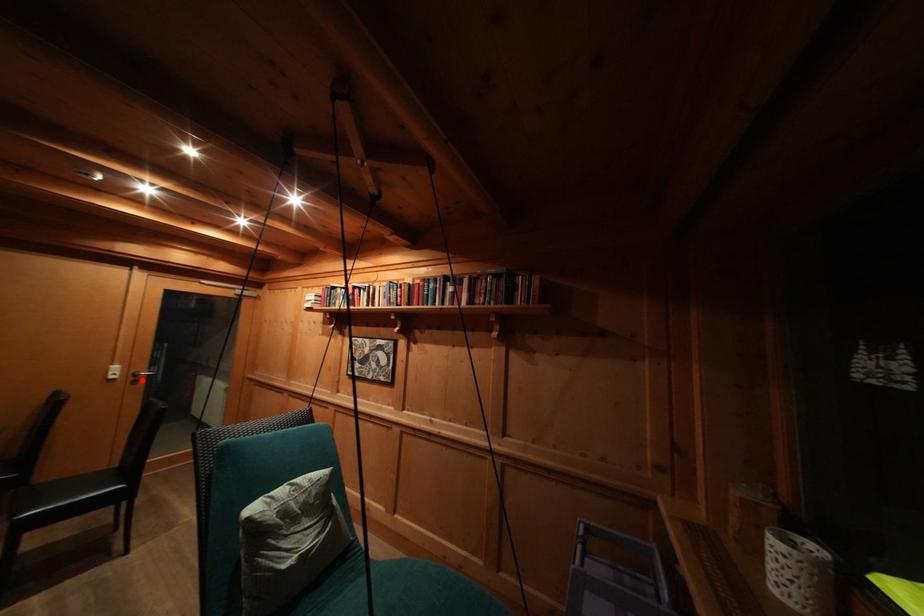
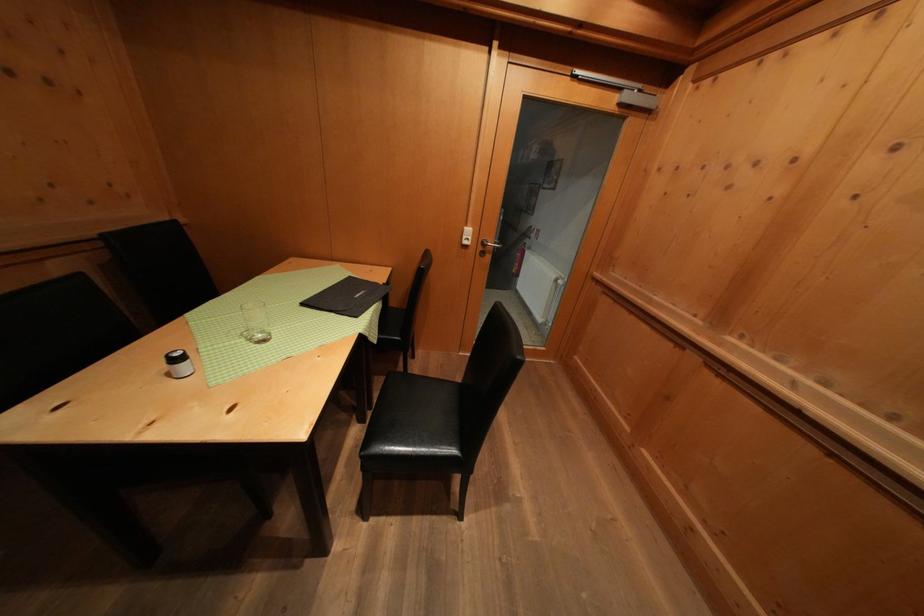
Where in the second image is the point corresponding to the highlighted location from the first image?

(490, 249)